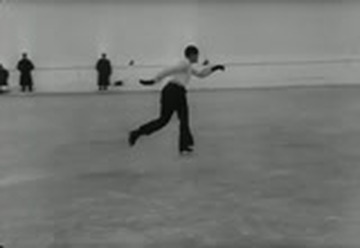
Find the location of a particular element. The width and height of the screenshot is (360, 248). floor is located at coordinates (253, 186).